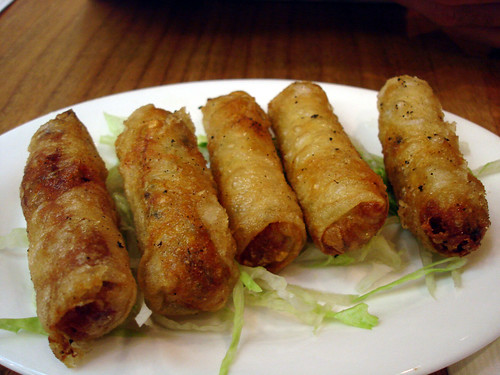
Locate an element on the screen. This screenshot has height=375, width=500. plate porcelain white is located at coordinates (433, 337).